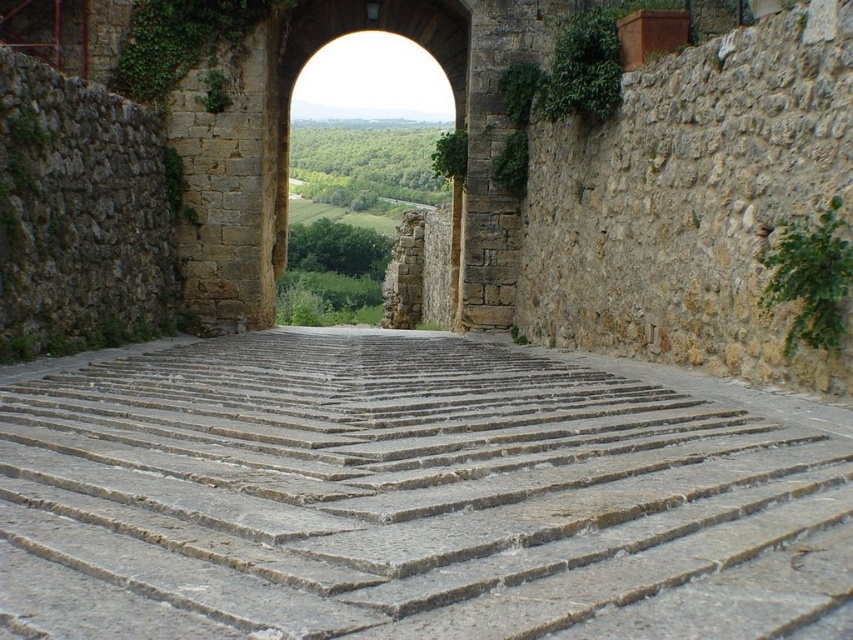
You are standing at the entrance of the arched gateway and want to reach the gray stone stairs at center. According to the image, in which direction should you walk to reach them?

The gray stone stairs at center are located at point (410, 496), so you should walk forward along the stone pathway towards the center to reach them.

You are a landscape architect designing a garden path. You have to place both the gray stone stairs at center and the stone archway at center along the path. Given their sizes, which object should be placed first to ensure proper spacing?

The gray stone stairs at center occupies less space than the stone archway at center, so you should place the stone archway at center first to allow enough space for both objects along the path.